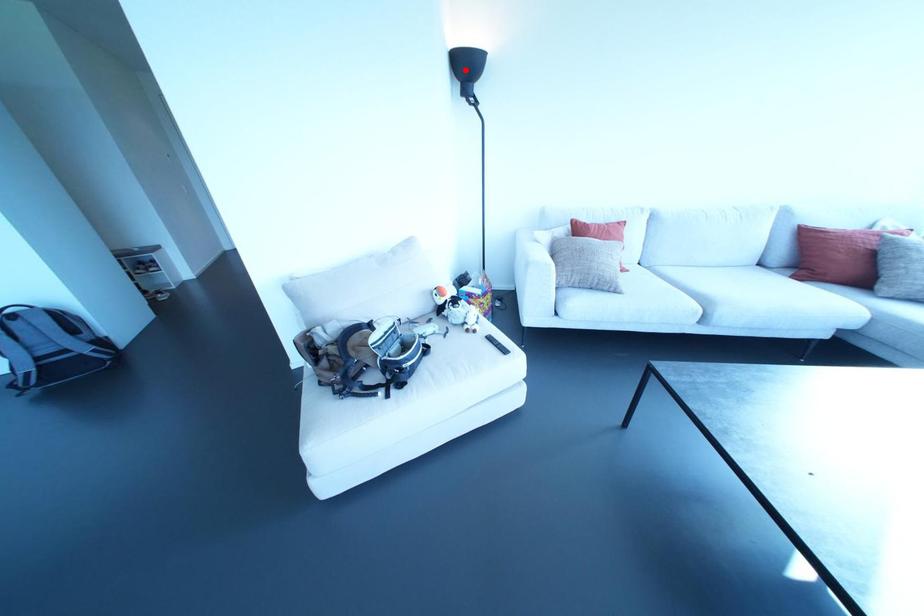
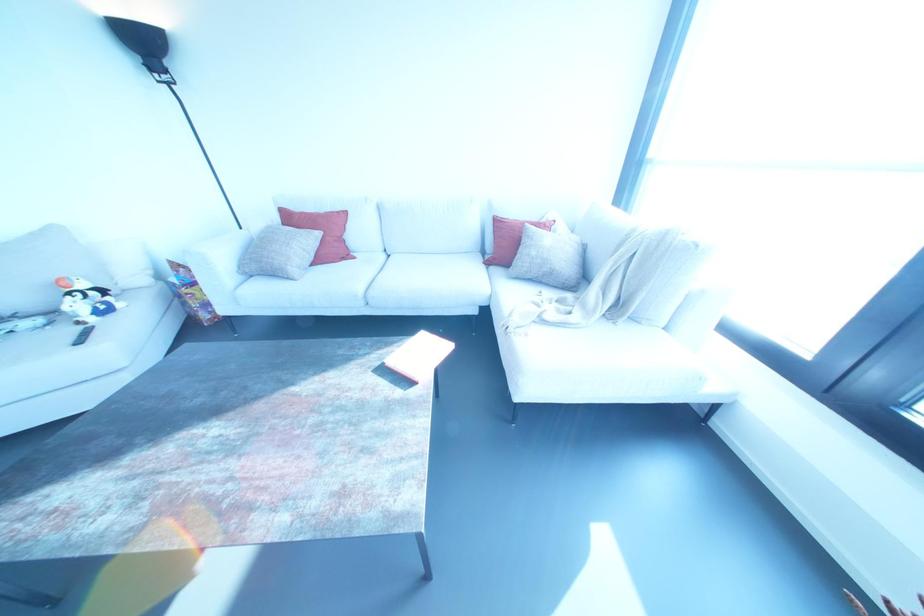
Find the pixel in the second image that matches the highlighted location in the first image.

(142, 44)